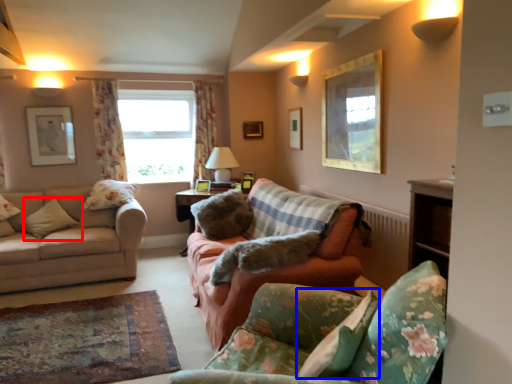
Question: Which point is further to the camera, pillow (highlighted by a red box) or pillow (highlighted by a blue box)?

Choices:
 (A) pillow
 (B) pillow

Answer: (A)